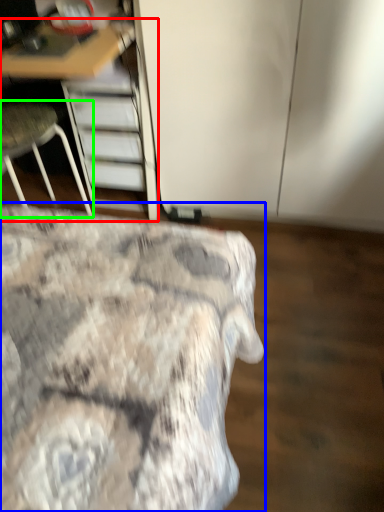
Question: Which object is the farthest from furniture (highlighted by a red box)? Choose among these: bed (highlighted by a blue box) or chair (highlighted by a green box).

Choices:
 (A) bed
 (B) chair

Answer: (A)